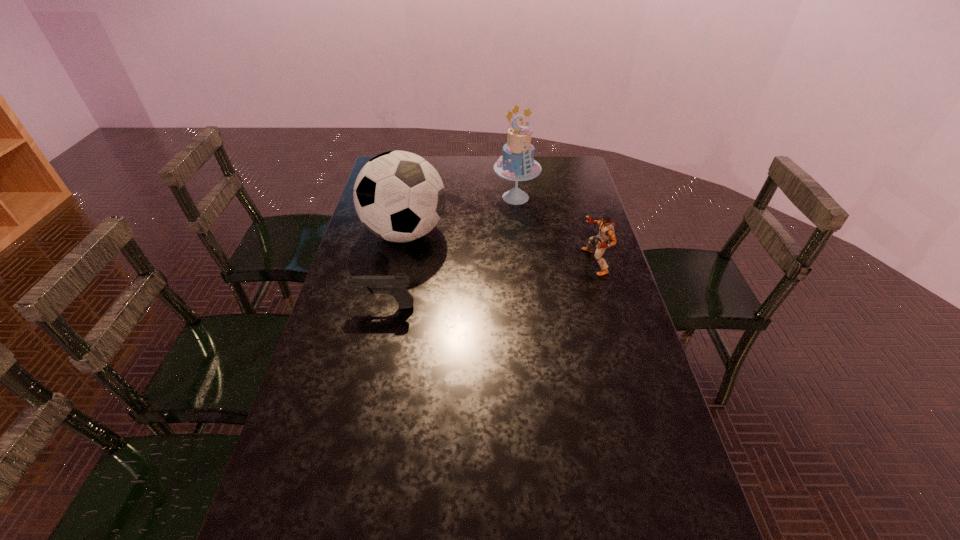
Locate an element on the screen. the nearest object is located at coordinates (396, 285).

Find the location of a particular element. This screenshot has width=960, height=540. pistol is located at coordinates (396, 285).

Find the location of a particular element. puncher is located at coordinates (606, 230).

Locate an element on the screen. This screenshot has width=960, height=540. the third tallest object is located at coordinates (606, 230).

Where is `cake`? This screenshot has height=540, width=960. cake is located at coordinates (517, 164).

Where is `the tallest object`? Image resolution: width=960 pixels, height=540 pixels. the tallest object is located at coordinates (517, 164).

Where is `the second tallest object`? The height and width of the screenshot is (540, 960). the second tallest object is located at coordinates (399, 196).

Find the location of a particular element. The height and width of the screenshot is (540, 960). free space located on the front-facing side of the rightmost object is located at coordinates (550, 262).

Find the location of a particular element. This screenshot has width=960, height=540. free space located on the front-facing side of the rightmost object is located at coordinates (550, 262).

The width and height of the screenshot is (960, 540). In order to click on free space located on the front-facing side of the rightmost object in this screenshot , I will do `click(532, 262)`.